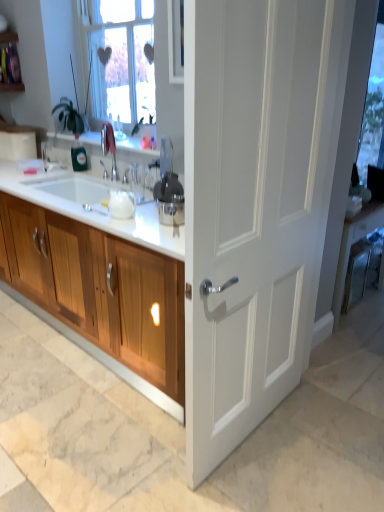
Question: Considering the positions of point (144, 327) and point (261, 206), is point (144, 327) closer or farther from the camera than point (261, 206)?

Choices:
 (A) farther
 (B) closer

Answer: (A)

Question: Is wooden cabinet at left in front of or behind white matte door at center in the image?

Choices:
 (A) front
 (B) behind

Answer: (B)

Question: Which object is positioned closest to the satin silver juicer at center?

Choices:
 (A) wooden cabinet at left
 (B) transparent glass window screen at upper right
 (C) white glossy countertop at center
 (D) white matte door at center

Answer: (C)

Question: Which of these objects is positioned farthest from the wooden cabinet at left?

Choices:
 (A) white matte door at center
 (B) white glossy countertop at center
 (C) satin silver juicer at center
 (D) transparent glass window screen at upper right

Answer: (D)